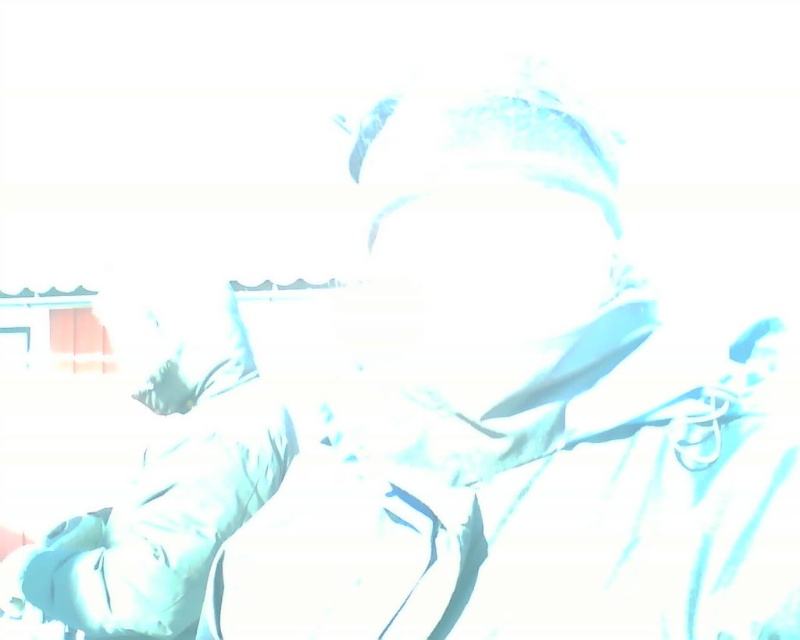
You are a fashion designer analyzing the image. You notice two white items of clothing, the white fabric at center and the matte white shirt at lower left. Which of these two items is shorter in height?

The white fabric at center has a lesser height compared to the matte white shirt at lower left, so the white fabric at center is shorter in height.